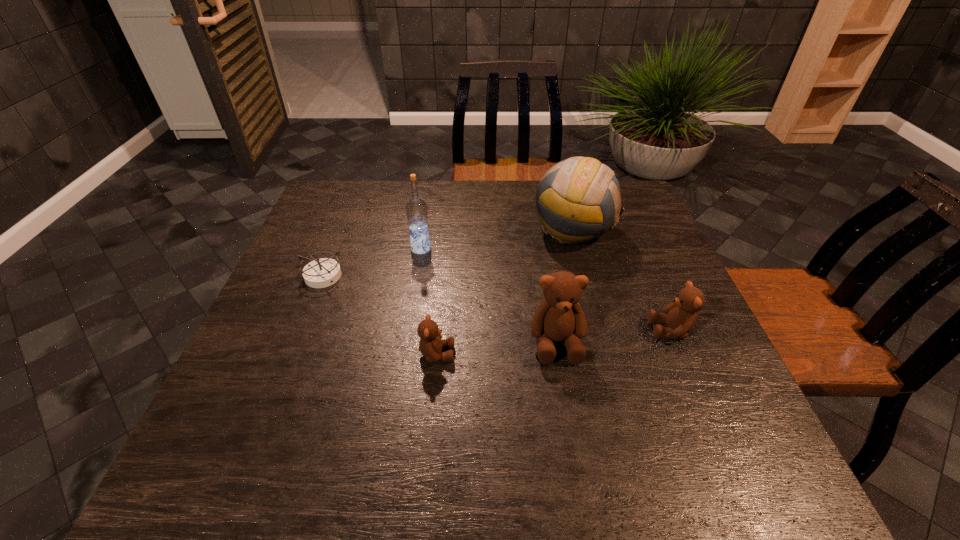
Select which teddy bear is the closest to the fifth tallest object. Please provide its 2D coordinates. Your answer should be formatted as a tuple, i.e. [(x, y)], where the tuple contains the x and y coordinates of a point satisfying the conditions above.

[(559, 317)]

Select which teddy bear is the closest to the second shortest teddy bear. Please provide its 2D coordinates. Your answer should be formatted as a tuple, i.e. [(x, y)], where the tuple contains the x and y coordinates of a point satisfying the conditions above.

[(559, 317)]

The height and width of the screenshot is (540, 960). Find the location of `vacant region that satisfies the following two spatial constraints: 1. on the face of the second teddy bear from left to right; 2. on the face of the second shortest object`. vacant region that satisfies the following two spatial constraints: 1. on the face of the second teddy bear from left to right; 2. on the face of the second shortest object is located at coordinates (559, 354).